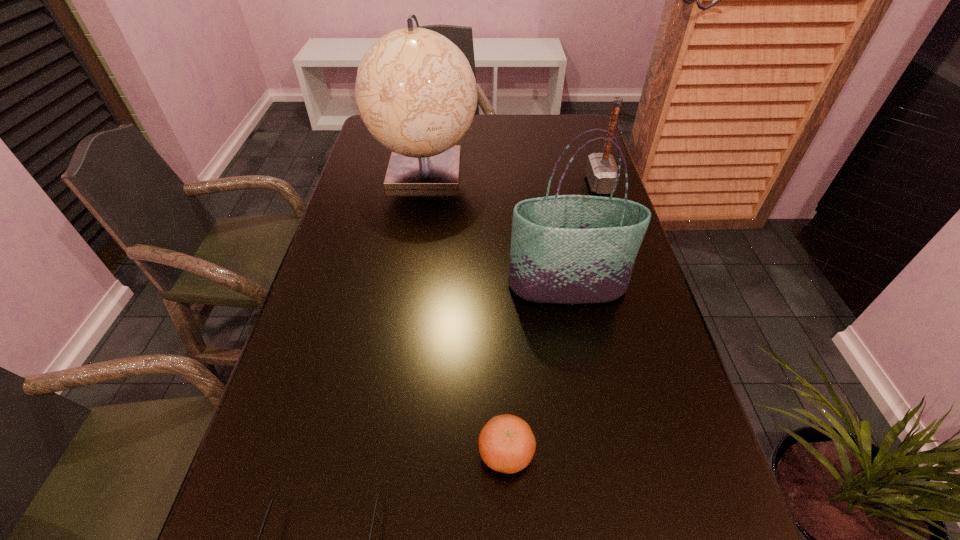
The height and width of the screenshot is (540, 960). In order to click on free point located on the left of the fourth tallest object in this screenshot , I will do `click(416, 453)`.

What are the coordinates of `object that is at the far edge` in the screenshot? It's located at (415, 91).

I want to click on object that is positioned at the left edge, so click(415, 91).

Where is `tote bag present at the right edge`? This screenshot has height=540, width=960. tote bag present at the right edge is located at coordinates (566, 249).

You are a GUI agent. You are given a task and a screenshot of the screen. Output one action in this format:
    pyautogui.click(x=<x>, y=<y>)
    Task: Click on the hammer present at the right edge
    The width and height of the screenshot is (960, 540).
    Given the screenshot: What is the action you would take?
    pyautogui.click(x=601, y=170)

Find the location of a particular element. This screenshot has height=540, width=960. object present at the far left corner is located at coordinates (415, 91).

Identify the location of free space at the far edge. Image resolution: width=960 pixels, height=540 pixels. (529, 132).

This screenshot has height=540, width=960. Find the location of `free space at the right edge of the desktop`. free space at the right edge of the desktop is located at coordinates (666, 462).

What are the coordinates of `vacant area at the far right corner` in the screenshot? It's located at (553, 116).

What are the coordinates of `vacant area that lies between the clementine and the globe` in the screenshot? It's located at (466, 310).